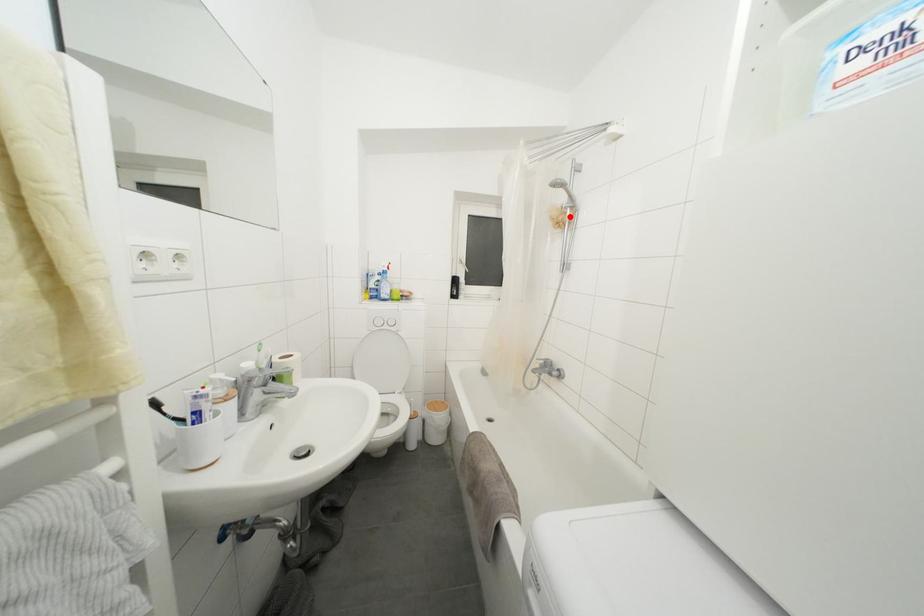
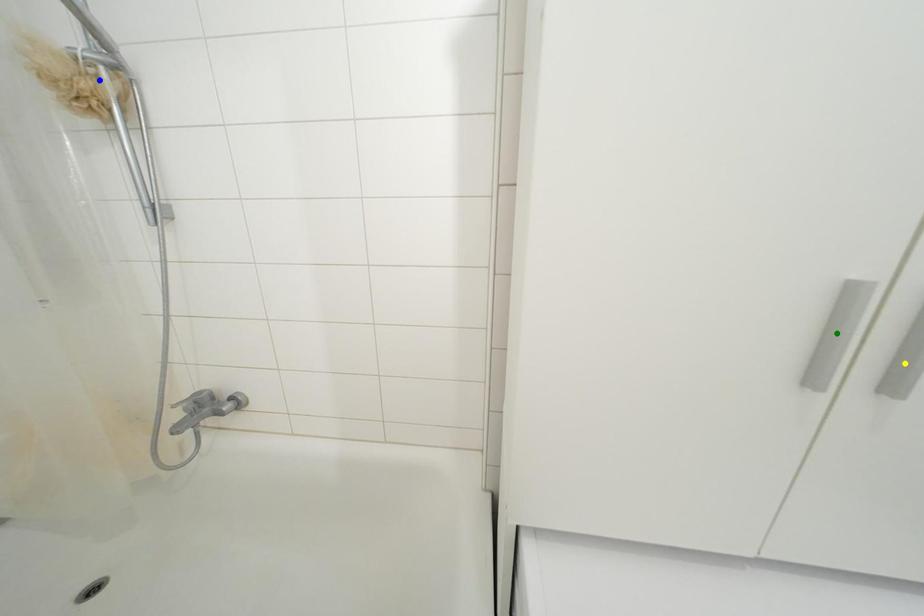
Question: I am providing you with two images of the same scene from different viewpoints. A red point is marked on the first image. You are given multiple points on the second image. In image 2, which mark is for the same physical point as the one in image 1?

Choices:
 (A) green point
 (B) blue point
 (C) yellow point

Answer: (B)